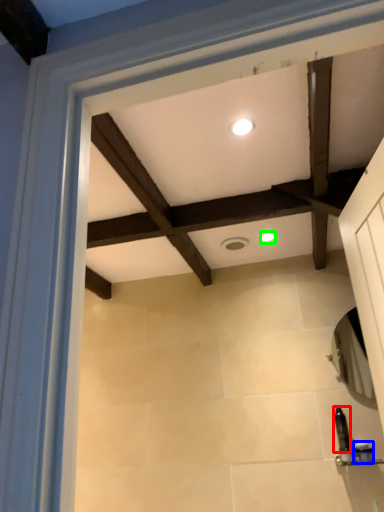
Question: Based on their relative distances, which object is farther from toiletry (highlighted by a red box)? Choose from toiletry (highlighted by a blue box) and lighting (highlighted by a green box).

Choices:
 (A) toiletry
 (B) lighting

Answer: (B)